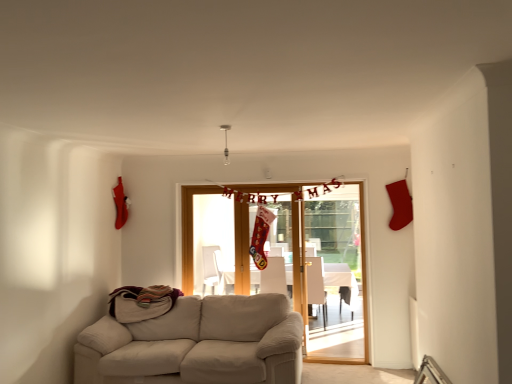
Question: From the image's perspective, would you say beige fabric couch at lower left is shown under wooden door at center?

Choices:
 (A) yes
 (B) no

Answer: (A)

Question: Does beige fabric couch at lower left turn towards wooden door at center?

Choices:
 (A) no
 (B) yes

Answer: (A)

Question: Can you confirm if beige fabric couch at lower left is shorter than wooden door at center?

Choices:
 (A) no
 (B) yes

Answer: (B)

Question: From a real-world perspective, does beige fabric couch at lower left stand above wooden door at center?

Choices:
 (A) no
 (B) yes

Answer: (A)

Question: Is the depth of beige fabric couch at lower left greater than that of wooden door at center?

Choices:
 (A) no
 (B) yes

Answer: (A)

Question: Relative to matte white armchair at center, which appears as the second armchair when viewed from the left, is white fabric armchair at center, the second armchair viewed from the right, in front or behind?

Choices:
 (A) behind
 (B) front

Answer: (A)

Question: From the image's perspective, is white fabric armchair at center, acting as the 1th armchair starting from the left, positioned above or below matte white armchair at center, which appears as the second armchair when viewed from the left?

Choices:
 (A) above
 (B) below

Answer: (A)

Question: Is point (283, 284) positioned closer to the camera than point (316, 279)?

Choices:
 (A) farther
 (B) closer

Answer: (A)

Question: From a real-world perspective, is white fabric armchair at center, the second armchair viewed from the right, positioned above or below matte white armchair at center, which appears as the second armchair when viewed from the left?

Choices:
 (A) above
 (B) below

Answer: (A)

Question: In terms of width, does wooden door at center look wider or thinner when compared to white glossy table at center?

Choices:
 (A) thin
 (B) wide

Answer: (A)

Question: Relative to white glossy table at center, is wooden door at center in front or behind?

Choices:
 (A) behind
 (B) front

Answer: (B)

Question: Is wooden door at center to the left or to the right of white glossy table at center in the image?

Choices:
 (A) right
 (B) left

Answer: (B)

Question: Is point (238, 241) positioned closer to the camera than point (251, 271)?

Choices:
 (A) closer
 (B) farther

Answer: (A)

Question: Is point (335, 276) closer or farther from the camera than point (284, 288)?

Choices:
 (A) closer
 (B) farther

Answer: (B)

Question: Would you say white glossy table at center is to the left or to the right of white fabric armchair at center, acting as the 1th armchair starting from the left, in the picture?

Choices:
 (A) right
 (B) left

Answer: (A)